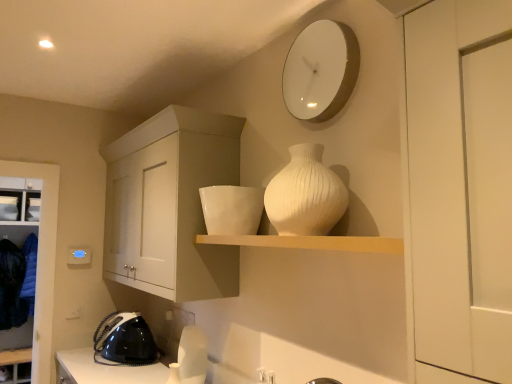
Question: Is black plastic iron at lower left, acting as the first appliance starting from the bottom, completely or partially outside of metallic silver iron at left, which is counted as the 3th appliance, starting from the front?

Choices:
 (A) yes
 (B) no

Answer: (A)

Question: Is black plastic iron at lower left, acting as the first appliance starting from the bottom, next to metallic silver iron at left, which appears as the 2th appliance when viewed from the top, and touching it?

Choices:
 (A) yes
 (B) no

Answer: (B)

Question: Considering the relative positions of black plastic iron at lower left, arranged as the second appliance when viewed from the left, and metallic silver iron at left, marked as the third appliance in a right-to-left arrangement, in the image provided, is black plastic iron at lower left, arranged as the second appliance when viewed from the left, to the right of metallic silver iron at left, marked as the third appliance in a right-to-left arrangement, from the viewer's perspective?

Choices:
 (A) no
 (B) yes

Answer: (B)

Question: Considering the relative sizes of black plastic iron at lower left, acting as the first appliance starting from the bottom, and metallic silver iron at left, which appears as the 2th appliance when viewed from the top, in the image provided, is black plastic iron at lower left, acting as the first appliance starting from the bottom, smaller than metallic silver iron at left, which appears as the 2th appliance when viewed from the top,?

Choices:
 (A) yes
 (B) no

Answer: (B)

Question: Considering the relative positions of black plastic iron at lower left, acting as the 2th appliance starting from the right, and metallic silver iron at left, which is counted as the 3th appliance, starting from the front, in the image provided, is black plastic iron at lower left, acting as the 2th appliance starting from the right, to the left of metallic silver iron at left, which is counted as the 3th appliance, starting from the front, from the viewer's perspective?

Choices:
 (A) no
 (B) yes

Answer: (A)

Question: Does point (18, 284) appear closer or farther from the camera than point (119, 364)?

Choices:
 (A) closer
 (B) farther

Answer: (B)

Question: Choose the correct answer: Is dark blue fabric at lower left inside black plastic iron at lower left, which is counted as the second appliance, starting from the back, or outside it?

Choices:
 (A) outside
 (B) inside

Answer: (A)

Question: From the image's perspective, is dark blue fabric at lower left located above or below black plastic iron at lower left, marked as the third appliance in a top-to-bottom arrangement?

Choices:
 (A) above
 (B) below

Answer: (B)

Question: Would you say dark blue fabric at lower left is to the left or to the right of black plastic iron at lower left, acting as the 2th appliance starting from the right, in the picture?

Choices:
 (A) left
 (B) right

Answer: (A)

Question: Considering the positions of white glossy bowl at upper center, the 1th appliance from the top, and white ribbed vase at center in the image, is white glossy bowl at upper center, the 1th appliance from the top, taller or shorter than white ribbed vase at center?

Choices:
 (A) short
 (B) tall

Answer: (A)

Question: Relative to white ribbed vase at center, is white glossy bowl at upper center, which is the 3th appliance in left-to-right order, in front or behind?

Choices:
 (A) front
 (B) behind

Answer: (B)

Question: From a real-world perspective, relative to white ribbed vase at center, is white glossy bowl at upper center, acting as the third appliance starting from the back, vertically above or below?

Choices:
 (A) below
 (B) above

Answer: (A)

Question: Is white glossy bowl at upper center, acting as the third appliance starting from the back, bigger or smaller than white ribbed vase at center?

Choices:
 (A) small
 (B) big

Answer: (A)

Question: Based on their sizes in the image, would you say metallic silver iron at left, which appears as the 2th appliance when viewed from the top, is bigger or smaller than white matte shelf at upper center?

Choices:
 (A) big
 (B) small

Answer: (B)

Question: From the image's perspective, is metallic silver iron at left, which appears as the 2th appliance when viewed from the top, located above or below white matte shelf at upper center?

Choices:
 (A) above
 (B) below

Answer: (A)